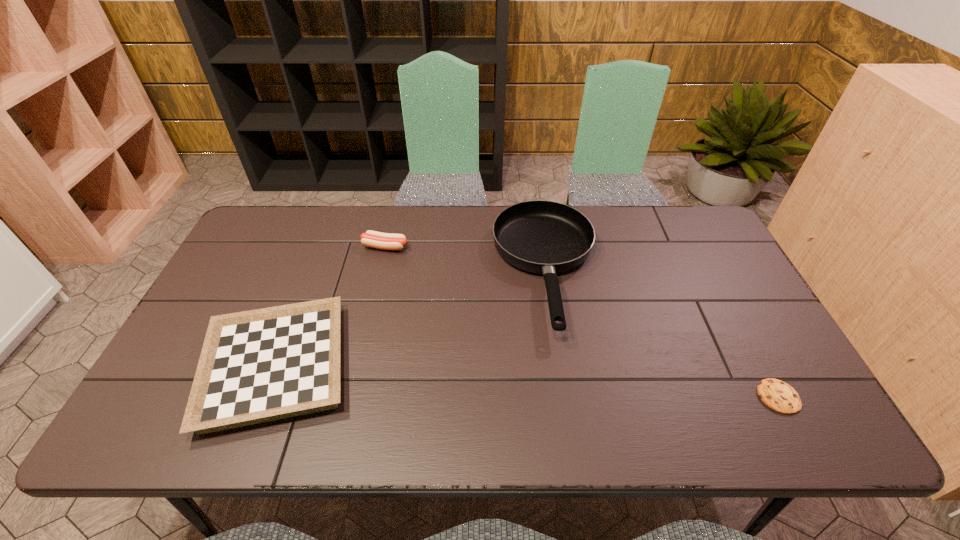
Locate an element on the screen. the second object from right to left is located at coordinates (544, 237).

I want to click on the tallest object, so click(x=544, y=237).

The width and height of the screenshot is (960, 540). I want to click on sausage, so click(x=387, y=241).

Image resolution: width=960 pixels, height=540 pixels. I want to click on checkerboard, so click(267, 364).

The height and width of the screenshot is (540, 960). I want to click on the rightmost object, so click(779, 396).

Where is `the shortest object`? The width and height of the screenshot is (960, 540). the shortest object is located at coordinates (779, 396).

This screenshot has width=960, height=540. I want to click on free space located 0.090m at the end of the handle of the frying pan, so click(x=562, y=375).

Where is `vacant point located 0.260m on the left of the sausage`? Image resolution: width=960 pixels, height=540 pixels. vacant point located 0.260m on the left of the sausage is located at coordinates (280, 247).

The image size is (960, 540). Find the location of `free region located 0.300m on the right of the checkerboard`. free region located 0.300m on the right of the checkerboard is located at coordinates (476, 367).

I want to click on free point located 0.360m on the left of the rightmost object, so click(604, 396).